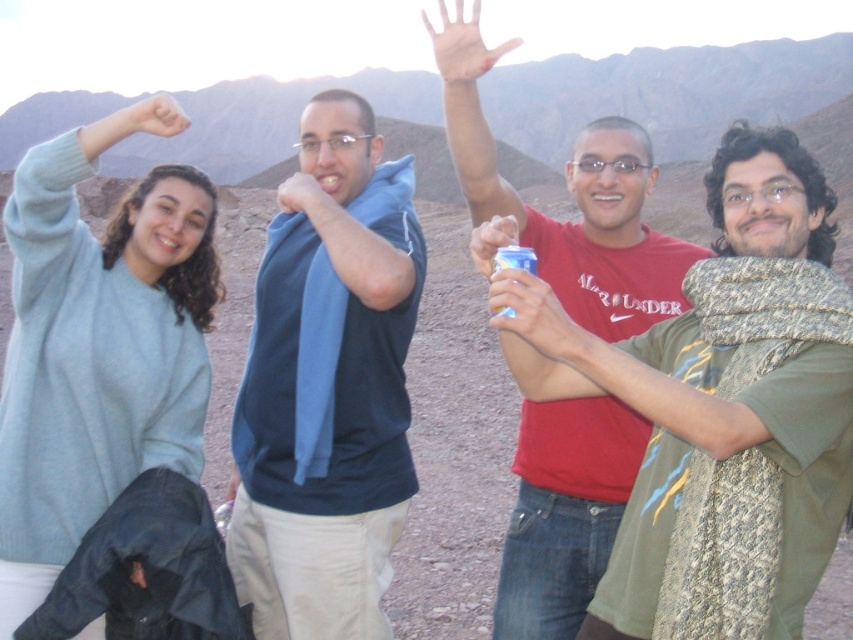
You are planning to take a photo of the group and want to ensure both the dark blue fabric at center and the light blue sweater at upper left are clearly visible. Which object should you focus on first to ensure proper exposure, considering their size in the frame?

The light blue sweater at upper left should be focused on first because it occupies more space in the frame than the dark blue fabric at center, ensuring proper exposure for the larger area.

You are a photographer trying to capture a clear shot of the blue metallic can at center without the matte blue shirt at center blocking it. Based on their positions, is this possible?

Yes, the blue metallic can at center is in front of the matte blue shirt at center, so it should be possible to capture a clear shot of the can without the shirt blocking it.